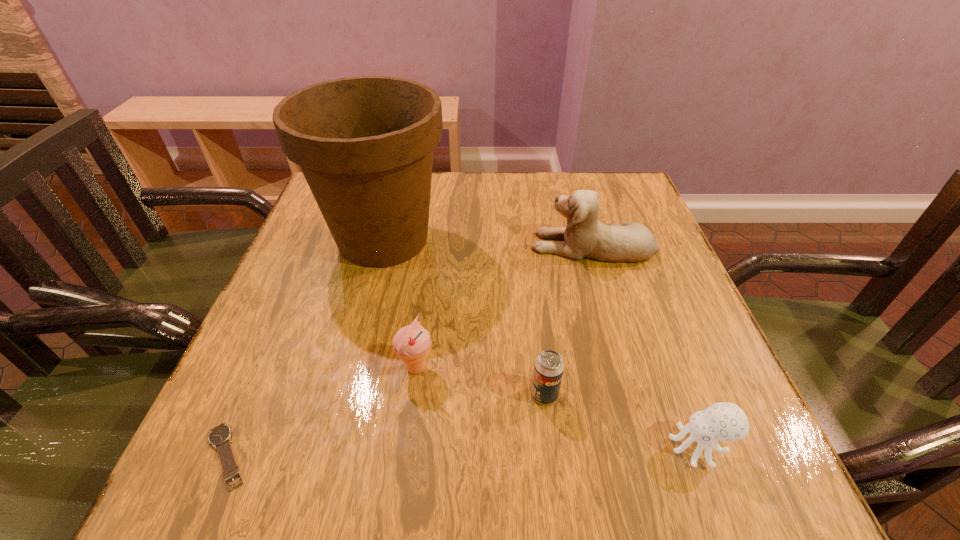
The image size is (960, 540). In order to click on the tallest object in this screenshot , I will do click(x=365, y=145).

Image resolution: width=960 pixels, height=540 pixels. What are the coordinates of `puppy` in the screenshot? It's located at (585, 236).

Where is `icecream`? The width and height of the screenshot is (960, 540). icecream is located at coordinates (412, 343).

This screenshot has height=540, width=960. What are the coordinates of `octopus` in the screenshot? It's located at (723, 421).

Where is `beer can`? Image resolution: width=960 pixels, height=540 pixels. beer can is located at coordinates point(548,370).

Where is `watch`? Image resolution: width=960 pixels, height=540 pixels. watch is located at coordinates (220, 436).

This screenshot has height=540, width=960. I want to click on vacant area situated on the front of the tallest object, so click(x=353, y=356).

I want to click on vacant space located 0.210m on the front-facing side of the fifth shortest object, so click(442, 245).

Identify the location of blank area located on the front-facing side of the fifth shortest object. The width and height of the screenshot is (960, 540). (370, 245).

Find the location of `vacant area situated 0.390m on the front-facing side of the fifth shortest object`. vacant area situated 0.390m on the front-facing side of the fifth shortest object is located at coordinates (366, 245).